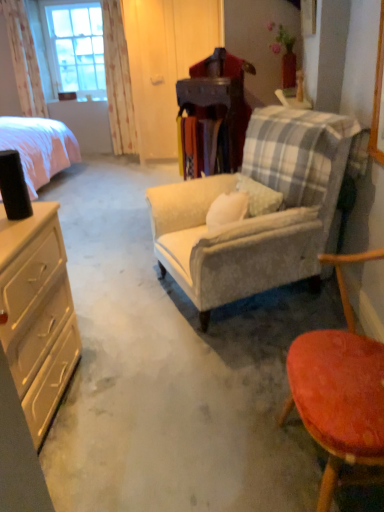
Question: From a real-world perspective, does smooth orange stool at lower right, which appears as the second chair when viewed from the back, stand above velvet beige armchair at center, arranged as the first chair when viewed from the back?

Choices:
 (A) no
 (B) yes

Answer: (A)

Question: From the image's perspective, is smooth orange stool at lower right, positioned as the first chair in front-to-back order, over velvet beige armchair at center, which is the second chair in front-to-back order?

Choices:
 (A) no
 (B) yes

Answer: (A)

Question: Is smooth orange stool at lower right, which appears as the second chair when viewed from the back, not close to velvet beige armchair at center, which is the second chair in front-to-back order?

Choices:
 (A) no
 (B) yes

Answer: (A)

Question: From a real-world perspective, is smooth orange stool at lower right, which appears as the second chair when viewed from the back, below velvet beige armchair at center, arranged as the first chair when viewed from the back?

Choices:
 (A) yes
 (B) no

Answer: (A)

Question: Can velvet beige armchair at center, arranged as the first chair when viewed from the back, be found inside smooth orange stool at lower right, positioned as the first chair in front-to-back order?

Choices:
 (A) no
 (B) yes

Answer: (A)

Question: Is matte beige dresser at left in front of or behind velvet beige armchair at center, which is the second chair in front-to-back order, in the image?

Choices:
 (A) front
 (B) behind

Answer: (A)

Question: Is matte beige dresser at left bigger or smaller than velvet beige armchair at center, arranged as the first chair when viewed from the back?

Choices:
 (A) big
 (B) small

Answer: (B)

Question: Considering the positions of point (48, 226) and point (289, 207), is point (48, 226) closer or farther from the camera than point (289, 207)?

Choices:
 (A) closer
 (B) farther

Answer: (A)

Question: From the image's perspective, relative to velvet beige armchair at center, arranged as the first chair when viewed from the back, is matte beige dresser at left above or below?

Choices:
 (A) above
 (B) below

Answer: (B)

Question: Would you say clear glass window at upper left is inside or outside velvet beige armchair at center, arranged as the first chair when viewed from the back?

Choices:
 (A) inside
 (B) outside

Answer: (B)

Question: From a real-world perspective, is clear glass window at upper left physically located above or below velvet beige armchair at center, which is the second chair in front-to-back order?

Choices:
 (A) below
 (B) above

Answer: (B)

Question: From their relative heights in the image, would you say clear glass window at upper left is taller or shorter than velvet beige armchair at center, arranged as the first chair when viewed from the back?

Choices:
 (A) tall
 (B) short

Answer: (A)

Question: In the image, is clear glass window at upper left on the left side or the right side of velvet beige armchair at center, which is the second chair in front-to-back order?

Choices:
 (A) left
 (B) right

Answer: (A)

Question: Is clear glass window at upper left wider or thinner than matte beige dresser at left?

Choices:
 (A) thin
 (B) wide

Answer: (A)

Question: Is clear glass window at upper left inside the boundaries of matte beige dresser at left, or outside?

Choices:
 (A) inside
 (B) outside

Answer: (B)